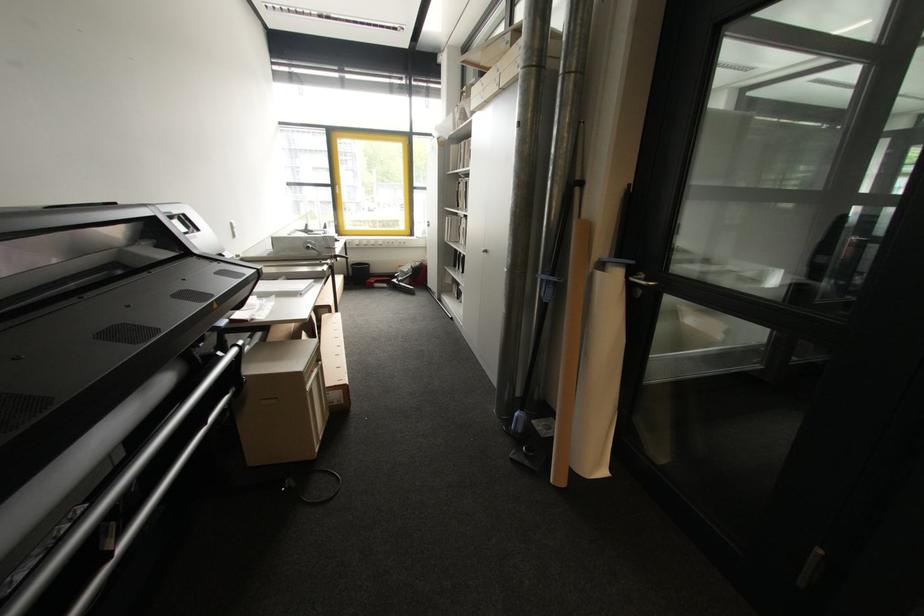
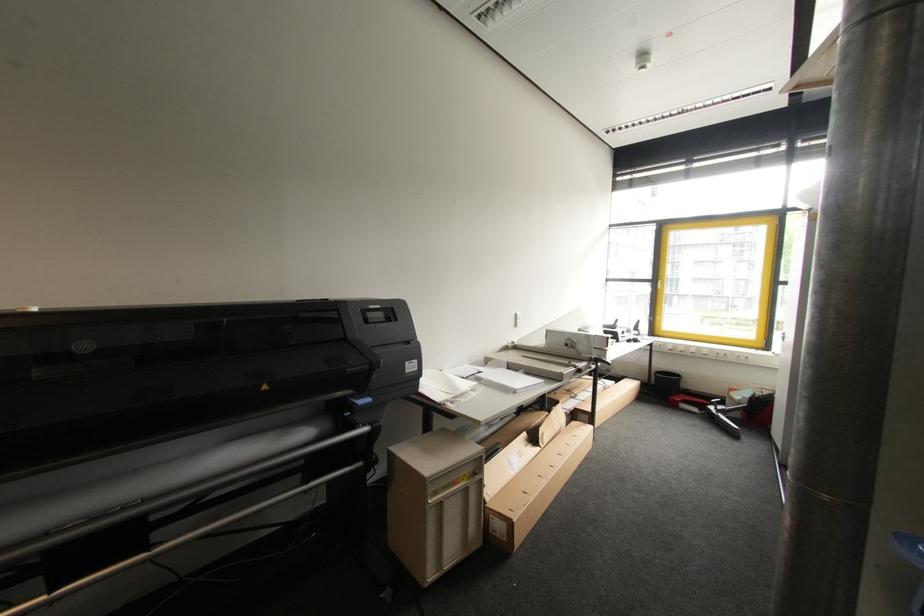
The point at (337, 185) is marked in the first image. Where is the corresponding point in the second image?

(660, 281)